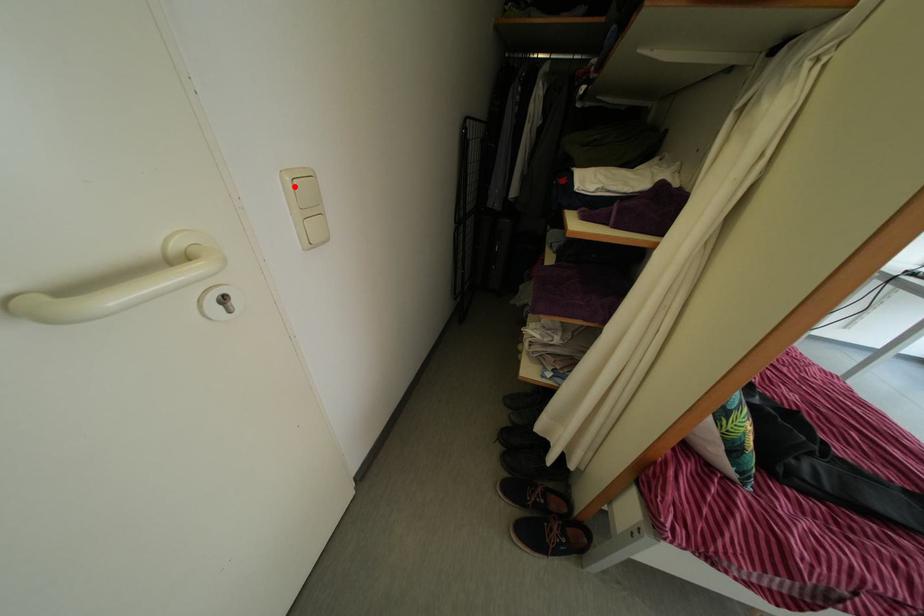
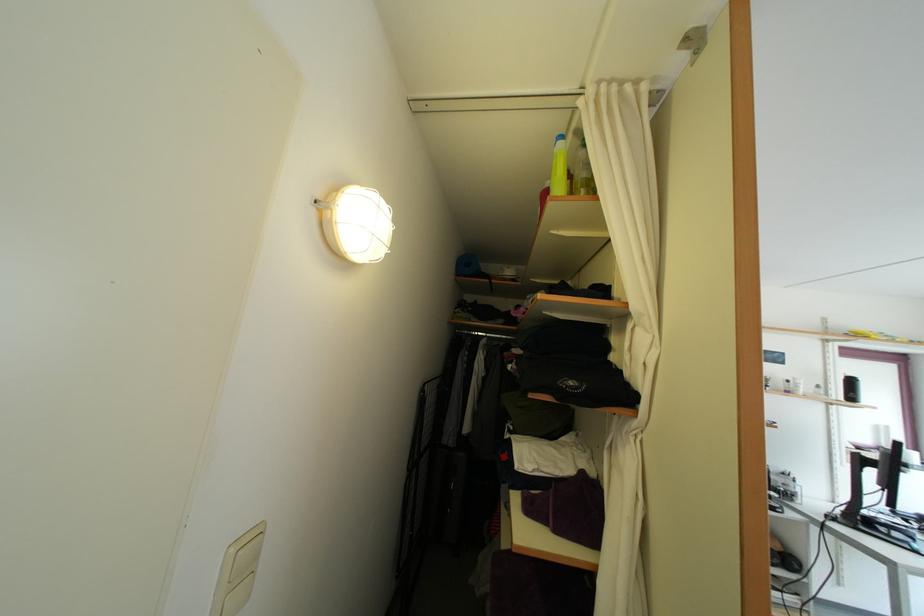
Where in the second image is the point corresponding to the highlighted location from the first image?

(239, 559)